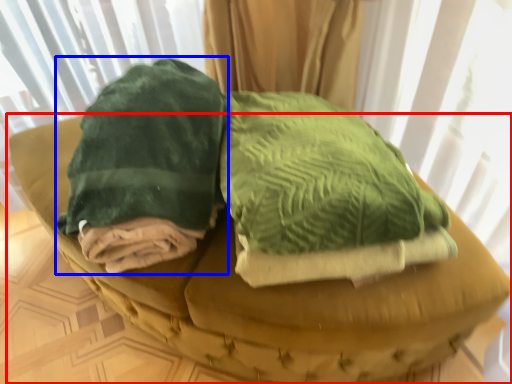
Question: Which of the following is the farthest to the observer, furniture (highlighted by a red box) or cloth (highlighted by a blue box)?

Choices:
 (A) furniture
 (B) cloth

Answer: (B)